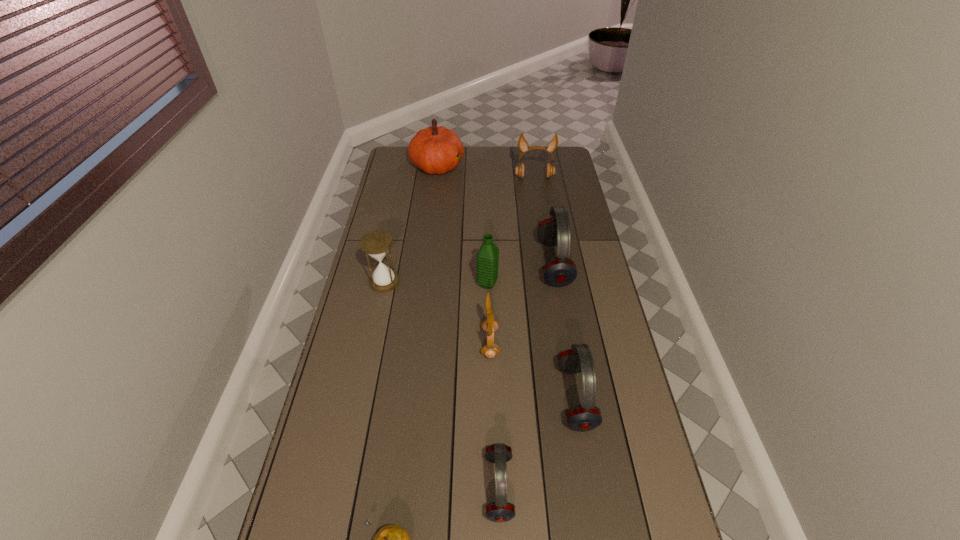
Where is `pink pumpkin`? The width and height of the screenshot is (960, 540). pink pumpkin is located at coordinates (434, 150).

Identify the location of the farthest red earphone. coord(560,271).

This screenshot has height=540, width=960. Identify the location of the biggest red earphone. (560, 271).

Find the location of `the right brown earphone`. the right brown earphone is located at coordinates (550, 170).

What are the coordinates of `the farther brown earphone` in the screenshot? It's located at (550, 170).

You are a GUI agent. You are given a task and a screenshot of the screen. Output one action in this format:
    pyautogui.click(x=<x>, y=<y>)
    Task: Click on the green water bottle
    Image resolution: width=960 pixels, height=540 pixels.
    Given the screenshot: What is the action you would take?
    pyautogui.click(x=488, y=255)

Where is `hourglass`? The image size is (960, 540). hourglass is located at coordinates [x=376, y=244].

Where is `the second farthest red earphone`? The width and height of the screenshot is (960, 540). the second farthest red earphone is located at coordinates (585, 417).

In order to click on the second nearest earphone in this screenshot , I will do `click(585, 417)`.

Identify the location of the sixth farthest object. The height and width of the screenshot is (540, 960). (489, 325).